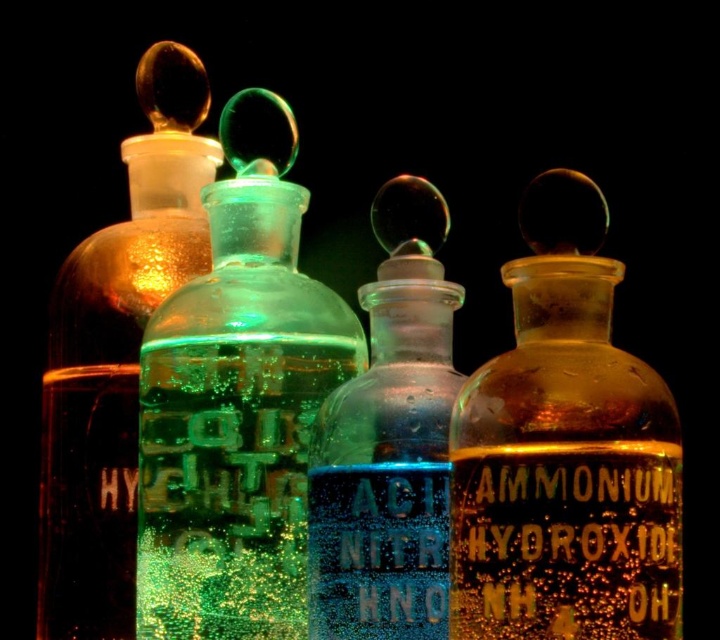
Who is positioned more to the left, translucent amber glass bottle at left or blue glass bottle at center?

From the viewer's perspective, translucent amber glass bottle at left appears more on the left side.

Does translucent amber glass bottle at left appear on the left side of blue glass bottle at center?

Yes, translucent amber glass bottle at left is to the left of blue glass bottle at center.

Find the location of a particular element. The width and height of the screenshot is (720, 640). translucent amber glass bottle at left is located at coordinates click(117, 355).

Is green frosted glass bottle at center smaller than blue glass bottle at center?

No, green frosted glass bottle at center is not smaller than blue glass bottle at center.

Does point (202, 348) lie behind point (387, 600)?

That is True.

Who is more distant from viewer, (229, 467) or (428, 632)?

→ The point (229, 467) is more distant.

Identify the location of green frosted glass bottle at center. (235, 403).

Measure the distance between green frosted glass bottle at center and camera.

The distance of green frosted glass bottle at center from camera is 94.30 centimeters.

The image size is (720, 640). What do you see at coordinates (235, 403) in the screenshot?
I see `green frosted glass bottle at center` at bounding box center [235, 403].

Identify the location of green frosted glass bottle at center. (235, 403).